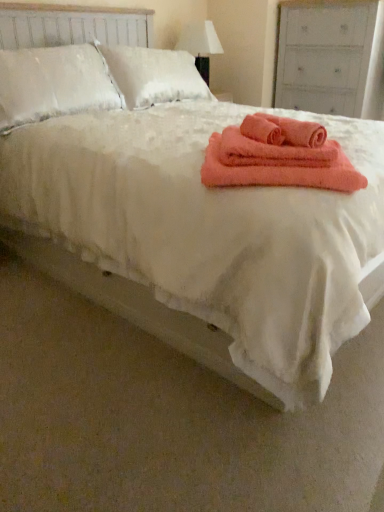
Question: From a real-world perspective, is coral fuzzy bath towel at center, which appears as the second bath towel when viewed from the left, under white fabric lampshade at upper center?

Choices:
 (A) yes
 (B) no

Answer: (A)

Question: Considering the relative positions of coral fuzzy bath towel at center, which appears as the second bath towel when viewed from the left, and white fabric lampshade at upper center in the image provided, is coral fuzzy bath towel at center, which appears as the second bath towel when viewed from the left, to the left of white fabric lampshade at upper center from the viewer's perspective?

Choices:
 (A) no
 (B) yes

Answer: (A)

Question: Is white fabric lampshade at upper center completely or partially inside coral fuzzy bath towel at center, which is the 2th bath towel from right to left?

Choices:
 (A) yes
 (B) no

Answer: (B)

Question: Is coral fuzzy bath towel at center, which is the 2th bath towel from right to left, smaller than white fabric lampshade at upper center?

Choices:
 (A) no
 (B) yes

Answer: (B)

Question: Can you confirm if coral fuzzy bath towel at center, which appears as the second bath towel when viewed from the left, is wider than white fabric lampshade at upper center?

Choices:
 (A) no
 (B) yes

Answer: (B)

Question: Is coral fuzzy bath towel at center, which is the 2th bath towel from right to left, bigger than white fabric lampshade at upper center?

Choices:
 (A) no
 (B) yes

Answer: (A)

Question: Would you say white fabric lampshade at upper center is part of coral fuzzy bath towel at center, acting as the 1th bath towel starting from the right,'s contents?

Choices:
 (A) yes
 (B) no

Answer: (B)

Question: Is coral fuzzy bath towel at center, acting as the 1th bath towel starting from the right, taller than white fabric lampshade at upper center?

Choices:
 (A) yes
 (B) no

Answer: (B)

Question: From the image's perspective, is coral fuzzy bath towel at center, the 3th bath towel when ordered from left to right, under white fabric lampshade at upper center?

Choices:
 (A) no
 (B) yes

Answer: (B)

Question: Does coral fuzzy bath towel at center, the 3th bath towel when ordered from left to right, appear on the right side of white fabric lampshade at upper center?

Choices:
 (A) yes
 (B) no

Answer: (A)

Question: Is coral fuzzy bath towel at center, acting as the 1th bath towel starting from the right, wider than white fabric lampshade at upper center?

Choices:
 (A) yes
 (B) no

Answer: (B)

Question: Can we say coral fuzzy bath towel at center, acting as the 1th bath towel starting from the right, lies outside white fabric lampshade at upper center?

Choices:
 (A) yes
 (B) no

Answer: (A)

Question: Can you confirm if coral soft towel at center is taller than white fabric lampshade at upper center?

Choices:
 (A) yes
 (B) no

Answer: (B)